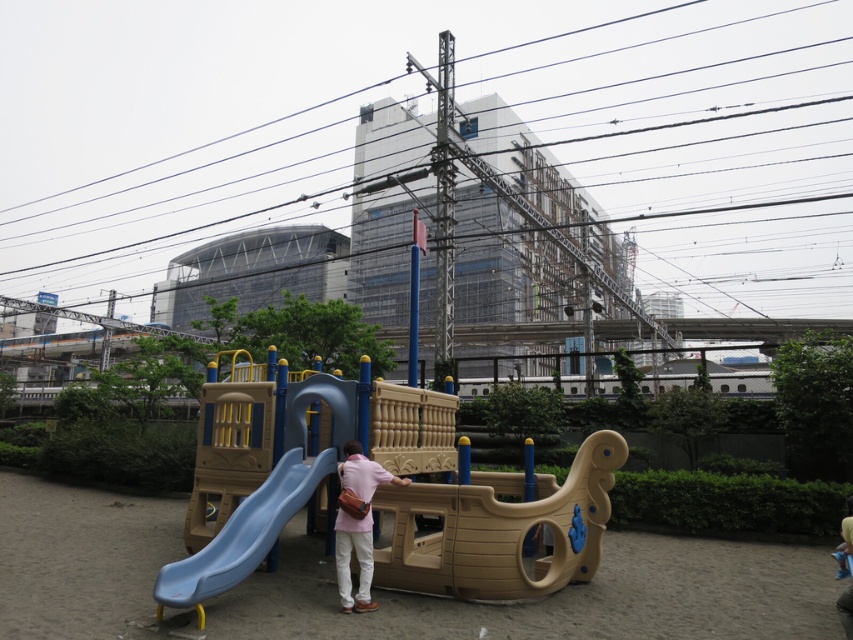
Question: Which of the following is the farthest from the observer?

Choices:
 (A) (169, 570)
 (B) (640, 253)

Answer: (B)

Question: Among these points, which one is farthest from the camera?

Choices:
 (A) click(x=247, y=499)
 (B) click(x=396, y=52)

Answer: (B)

Question: Does black wire at upper center come behind blue plastic slide at lower left?

Choices:
 (A) yes
 (B) no

Answer: (A)

Question: Is black wire at upper center above blue plastic slide at lower left?

Choices:
 (A) yes
 (B) no

Answer: (A)

Question: Can you confirm if black wire at upper center is positioned above blue plastic slide at lower left?

Choices:
 (A) yes
 (B) no

Answer: (A)